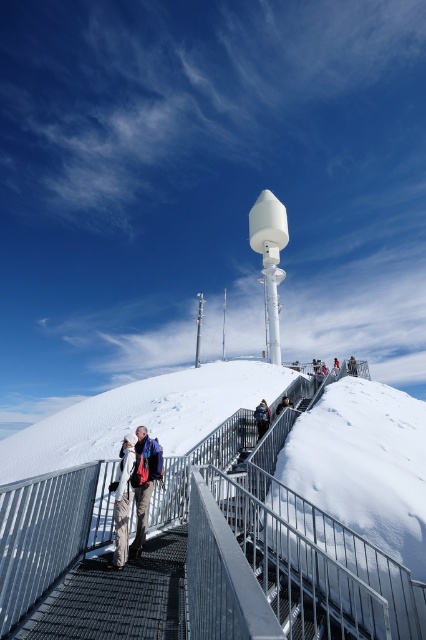
Question: Does metallic mesh stairs at center have a lesser width compared to khaki fabric pants at center?

Choices:
 (A) no
 (B) yes

Answer: (A)

Question: Which object is farther from the camera taking this photo?

Choices:
 (A) khaki fabric pants at center
 (B) metallic mesh stairs at center

Answer: (A)

Question: Is the position of metallic mesh stairs at center less distant than that of khaki fabric pants at center?

Choices:
 (A) no
 (B) yes

Answer: (B)

Question: In this image, where is metallic mesh stairs at center located relative to khaki fabric pants at center?

Choices:
 (A) below
 (B) above

Answer: (A)